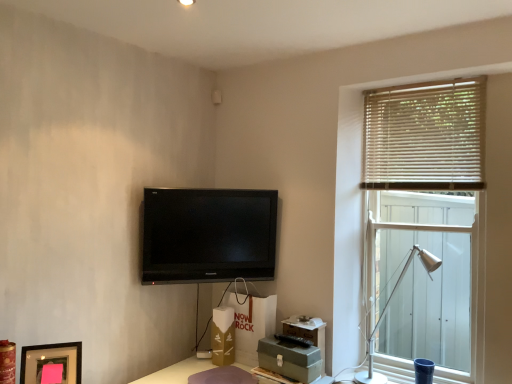
Find the location of a particular element. blank space above beige wooden blinds at upper right (from a real-world perspective) is located at coordinates pyautogui.click(x=428, y=86).